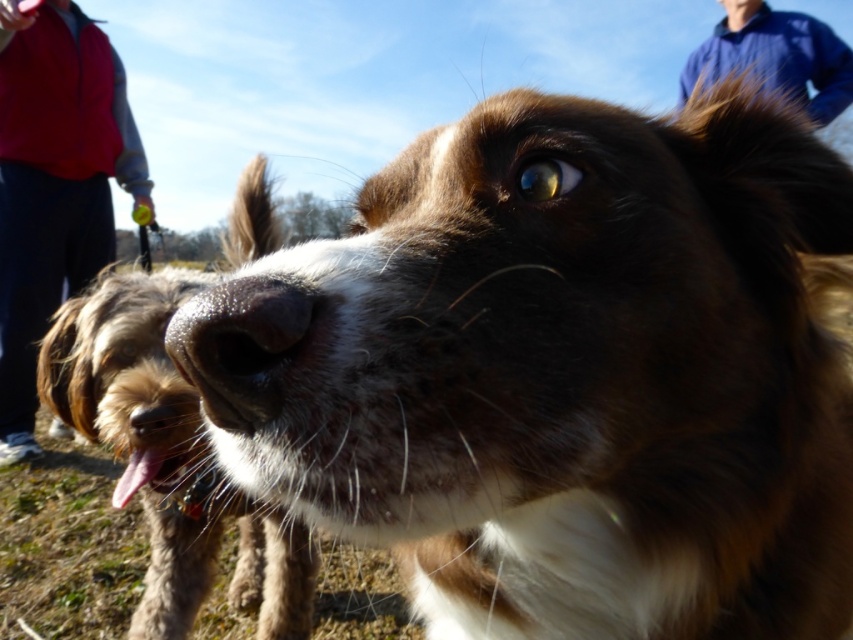
Is brown fuzzy dog at center shorter than red fleece jacket at left?

Indeed, brown fuzzy dog at center has a lesser height compared to red fleece jacket at left.

Can you confirm if brown fuzzy dog at center is wider than red fleece jacket at left?

Incorrect, brown fuzzy dog at center's width does not surpass red fleece jacket at left's.

Is point (184, 406) behind point (33, 116)?

No.

Image resolution: width=853 pixels, height=640 pixels. What are the coordinates of `brown fuzzy dog at center` in the screenshot? It's located at (169, 458).

Is point (108, 72) positioned in front of point (227, 376)?

No, it is behind (227, 376).

Consider the image. Which is below, red fleece jacket at left or wet fur at nose center?

wet fur at nose center

Which is behind, point (55, 282) or point (299, 374)?

Point (55, 282)

Image resolution: width=853 pixels, height=640 pixels. Identify the location of red fleece jacket at left. (53, 184).

Does brown fuzzy dog at center have a greater height compared to wet fur at nose center?

Indeed, brown fuzzy dog at center has a greater height compared to wet fur at nose center.

Can you confirm if brown fuzzy dog at center is positioned to the right of wet fur at nose center?

Incorrect, brown fuzzy dog at center is not on the right side of wet fur at nose center.

Between point (105, 282) and point (202, 372), which one is positioned in front?

Point (202, 372) is in front.

Image resolution: width=853 pixels, height=640 pixels. Find the location of `brown fuzzy dog at center`. brown fuzzy dog at center is located at coordinates (169, 458).